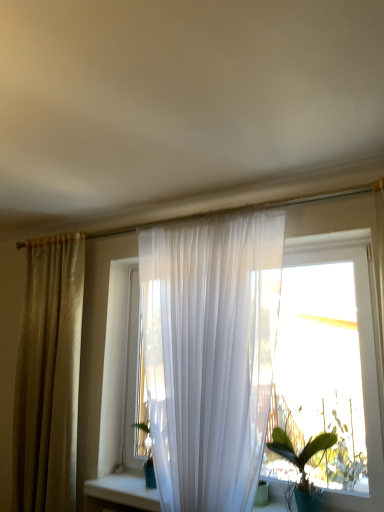
Question: Considering their positions, is green glossy leafy plant at lower right located in front of or behind translucent white curtain at center?

Choices:
 (A) behind
 (B) front

Answer: (A)

Question: From a real-world perspective, relative to translucent white curtain at center, is green glossy leafy plant at lower right vertically above or below?

Choices:
 (A) above
 (B) below

Answer: (B)

Question: Estimate the real-world distances between objects in this image. Which object is farther from the matte beige curtain at left?

Choices:
 (A) translucent white curtain at center
 (B) green glossy leafy plant at lower right

Answer: (B)

Question: Considering the real-world distances, which object is closest to the green glossy leafy plant at lower right?

Choices:
 (A) translucent white curtain at center
 (B) matte beige curtain at left

Answer: (A)